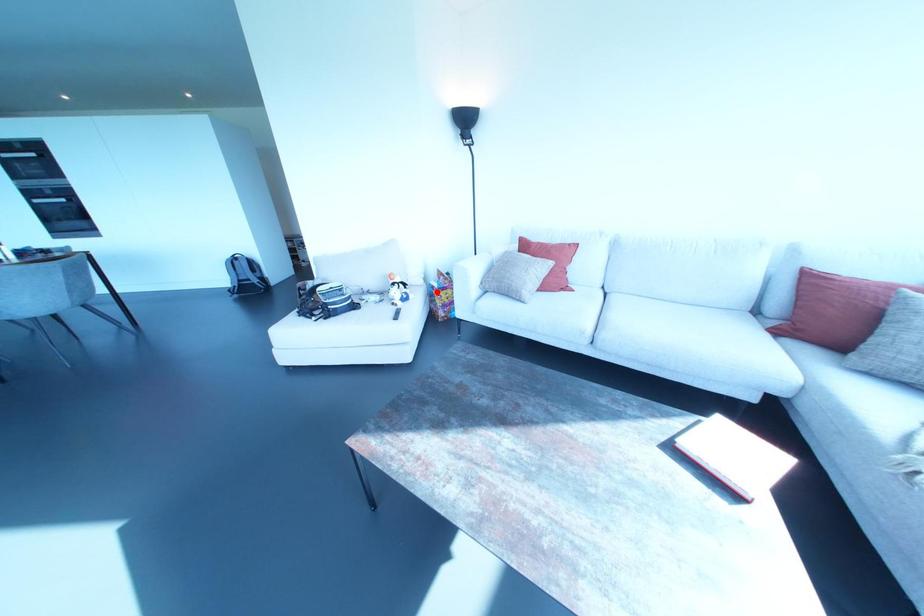
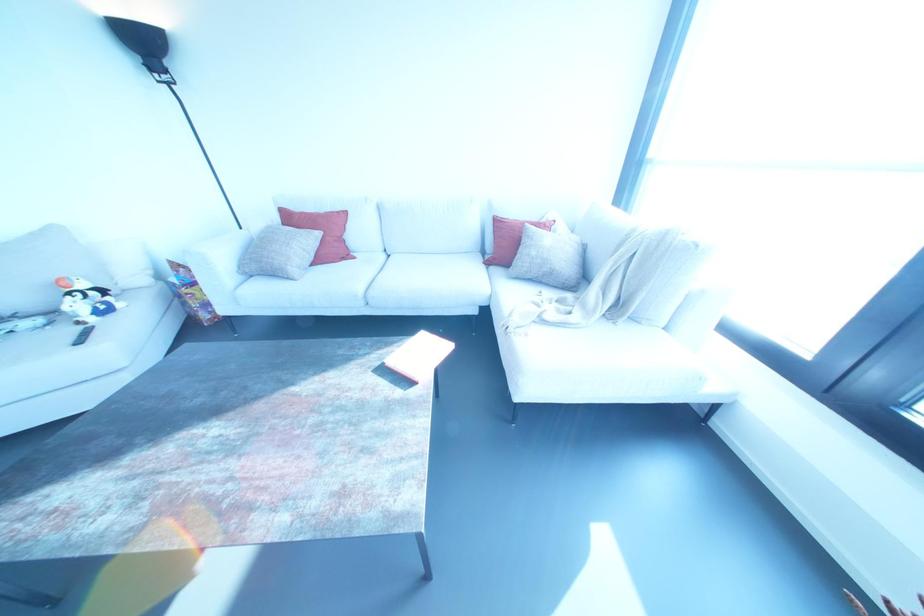
Where in the second image is the point corresponding to the highlighted location from the first image?

(184, 290)